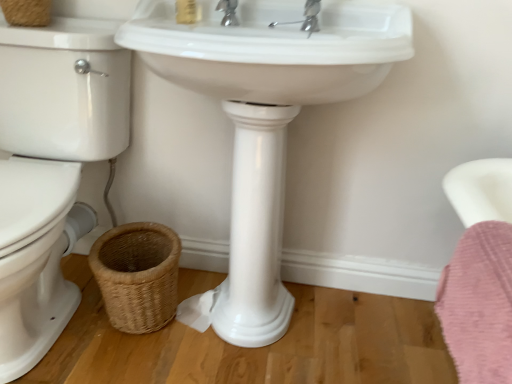
At what (x,y) coordinates should I click in order to perform the action: click on vacant space in front of woven natural basket at lower left, which is the 1th basket from right to left. Please return your answer as a coordinate pair (x, y). Looking at the image, I should click on 115,369.